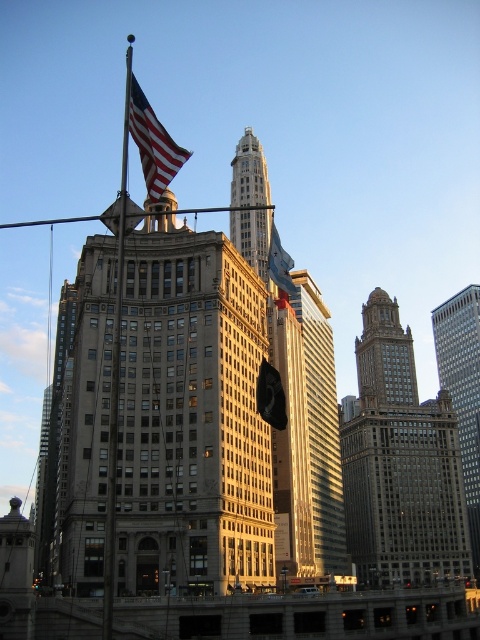
Who is shorter, golden stone building at center or brick textured building at center?

With less height is golden stone building at center.

Where is `golden stone building at center`? The image size is (480, 640). golden stone building at center is located at coordinates (191, 416).

The width and height of the screenshot is (480, 640). Find the location of `golden stone building at center`. golden stone building at center is located at coordinates (191, 416).

Can you confirm if polished metal flag pole at center is wider than american flag at upper left?

Correct, the width of polished metal flag pole at center exceeds that of american flag at upper left.

Can you confirm if polished metal flag pole at center is positioned to the right of american flag at upper left?

Incorrect, polished metal flag pole at center is not on the right side of american flag at upper left.

The height and width of the screenshot is (640, 480). Find the location of `polished metal flag pole at center`. polished metal flag pole at center is located at coordinates [x=116, y=369].

The image size is (480, 640). I want to click on polished metal flag pole at center, so click(116, 369).

Looking at this image, can you confirm if golden stone building at center is bigger than polished metal flag pole at center?

Actually, golden stone building at center might be smaller than polished metal flag pole at center.

Is golden stone building at center taller than polished metal flag pole at center?

Incorrect, golden stone building at center's height is not larger of polished metal flag pole at center's.

What are the coordinates of `golden stone building at center` in the screenshot? It's located at (191, 416).